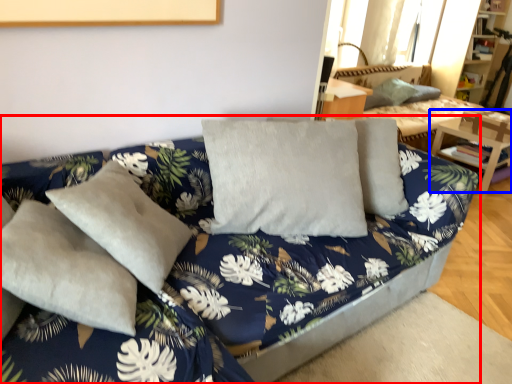
Question: Which object appears closest to the camera in this image, studio couch (highlighted by a red box) or table (highlighted by a blue box)?

Choices:
 (A) studio couch
 (B) table

Answer: (A)